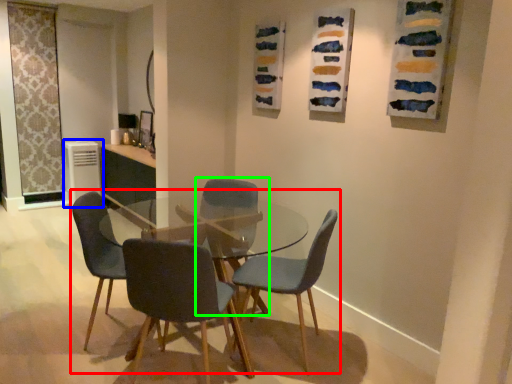
Question: Considering the real-world distances, which object is closest to kitchen & dining room table (highlighted by a red box)? appliance (highlighted by a blue box) or chair (highlighted by a green box).

Choices:
 (A) appliance
 (B) chair

Answer: (B)